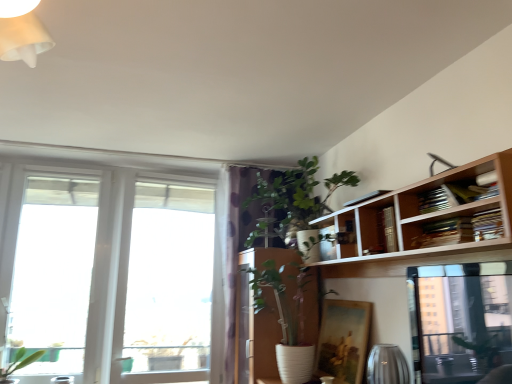
Question: Is wooden bookshelf at upper right located outside transparent glass window at left, which is the second window in left-to-right order?

Choices:
 (A) yes
 (B) no

Answer: (A)

Question: Can you confirm if wooden bookshelf at upper right is shorter than transparent glass window at left, which is the second window in left-to-right order?

Choices:
 (A) yes
 (B) no

Answer: (A)

Question: Considering the relative positions of wooden bookshelf at upper right and transparent glass window at left, positioned as the 1th window in right-to-left order, in the image provided, is wooden bookshelf at upper right to the left of transparent glass window at left, positioned as the 1th window in right-to-left order, from the viewer's perspective?

Choices:
 (A) no
 (B) yes

Answer: (A)

Question: From the image's perspective, is wooden bookshelf at upper right above transparent glass window at left, positioned as the 1th window in right-to-left order?

Choices:
 (A) no
 (B) yes

Answer: (B)

Question: Does wooden bookshelf at upper right appear on the right side of transparent glass window at left, which is the second window in left-to-right order?

Choices:
 (A) no
 (B) yes

Answer: (B)

Question: Can you confirm if wooden bookshelf at upper right is smaller than transparent glass window at left, positioned as the 1th window in right-to-left order?

Choices:
 (A) no
 (B) yes

Answer: (B)

Question: Does transparent glass window at left, the 1th window viewed from the left, have a lesser width compared to purple dotted fabric at center?

Choices:
 (A) no
 (B) yes

Answer: (B)

Question: From the image's perspective, is transparent glass window at left, which is counted as the 2th window, starting from the right, on top of purple dotted fabric at center?

Choices:
 (A) yes
 (B) no

Answer: (A)

Question: From a real-world perspective, is transparent glass window at left, the 1th window viewed from the left, physically below purple dotted fabric at center?

Choices:
 (A) yes
 (B) no

Answer: (B)

Question: From a real-world perspective, is transparent glass window at left, the 1th window viewed from the left, located higher than purple dotted fabric at center?

Choices:
 (A) yes
 (B) no

Answer: (A)

Question: From the image's perspective, is transparent glass window at left, which is counted as the 2th window, starting from the right, under purple dotted fabric at center?

Choices:
 (A) yes
 (B) no

Answer: (B)

Question: Is transparent glass window at left, which is counted as the 2th window, starting from the right, wider than purple dotted fabric at center?

Choices:
 (A) no
 (B) yes

Answer: (A)

Question: Does green leafy plant at upper center have a lesser height compared to transparent glass window at left, which is counted as the 2th window, starting from the right?

Choices:
 (A) no
 (B) yes

Answer: (B)